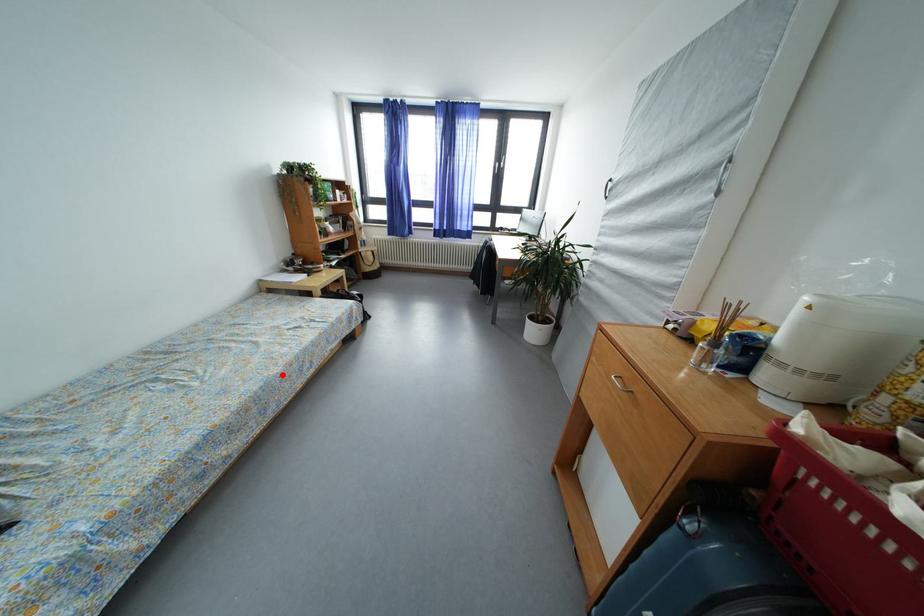
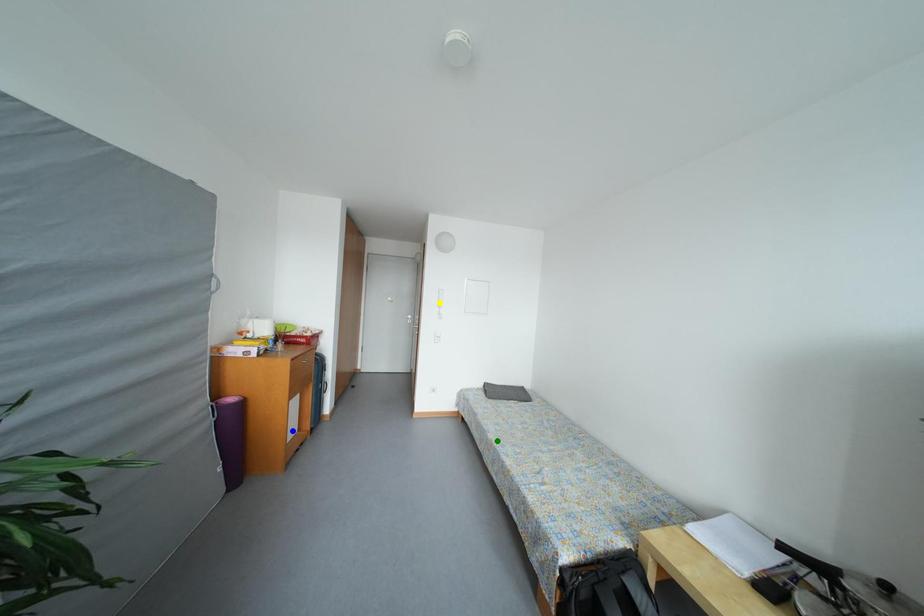
Question: I am providing you with two images of the same scene from different viewpoints. A red point is marked on the first image. You are given multiple points on the second image. Which point in image 2 is actually the same real-world point as the red point in image 1?

Choices:
 (A) blue point
 (B) green point
 (C) yellow point

Answer: (B)